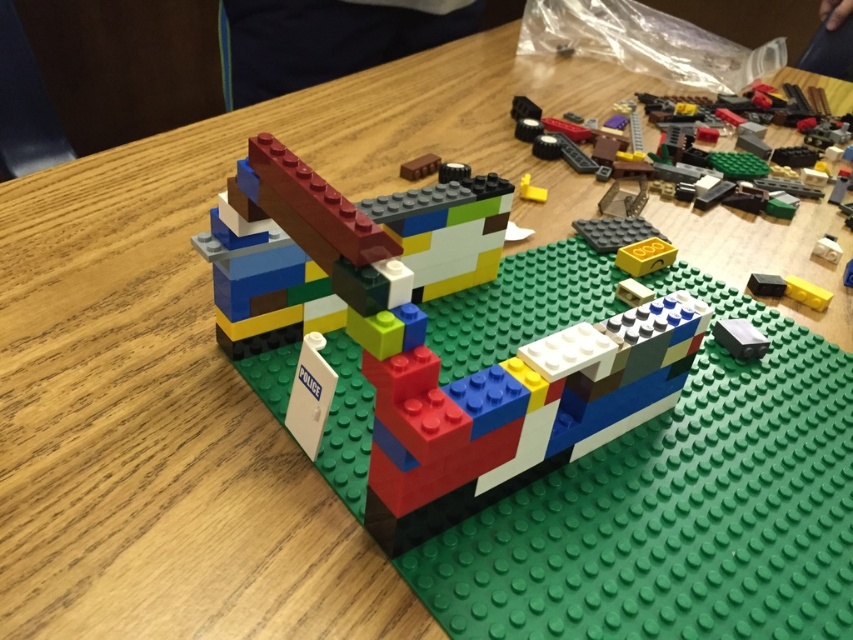
In order to click on multicolored plastic building blocks at center in this screenshot , I will do `click(445, 348)`.

Consider the image. Is translucent yellow plastic at upper right shorter than yellow matte block at center?

Incorrect, translucent yellow plastic at upper right's height does not fall short of yellow matte block at center's.

Who is more distant from viewer, (x=599, y=160) or (x=527, y=193)?

The point (x=599, y=160) is more distant.

Where is `translucent yellow plastic at upper right`? The height and width of the screenshot is (640, 853). translucent yellow plastic at upper right is located at coordinates 693,124.

Can you confirm if multicolored plastic blocks at center is wider than translucent yellow plastic at upper right?

In fact, multicolored plastic blocks at center might be narrower than translucent yellow plastic at upper right.

Identify the location of multicolored plastic blocks at center. (338, 248).